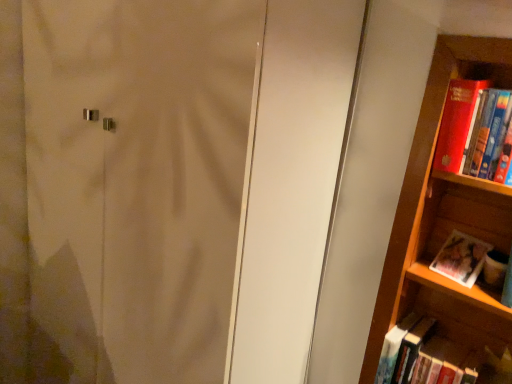
Question: Which is correct: matte white screen door at center is inside red matte book at right, which is the 1th book from top to bottom, or outside of it?

Choices:
 (A) inside
 (B) outside

Answer: (B)

Question: Considering the positions of point (153, 206) and point (467, 99), is point (153, 206) closer or farther from the camera than point (467, 99)?

Choices:
 (A) farther
 (B) closer

Answer: (A)

Question: Which of these objects is positioned farthest from the matte paper photo album at right, which ranks as the second book in top-to-bottom order?

Choices:
 (A) matte white screen door at center
 (B) red matte book at right, which is counted as the 3th book, starting from the bottom
 (C) hardcover book at lower right, positioned as the first book in bottom-to-top order

Answer: (A)

Question: Which of these objects is positioned closest to the red matte book at right, which is the 1th book from top to bottom?

Choices:
 (A) matte paper photo album at right, which ranks as the 2th book in bottom-to-top order
 (B) matte white screen door at center
 (C) hardcover book at lower right, positioned as the third book in top-to-bottom order

Answer: (A)